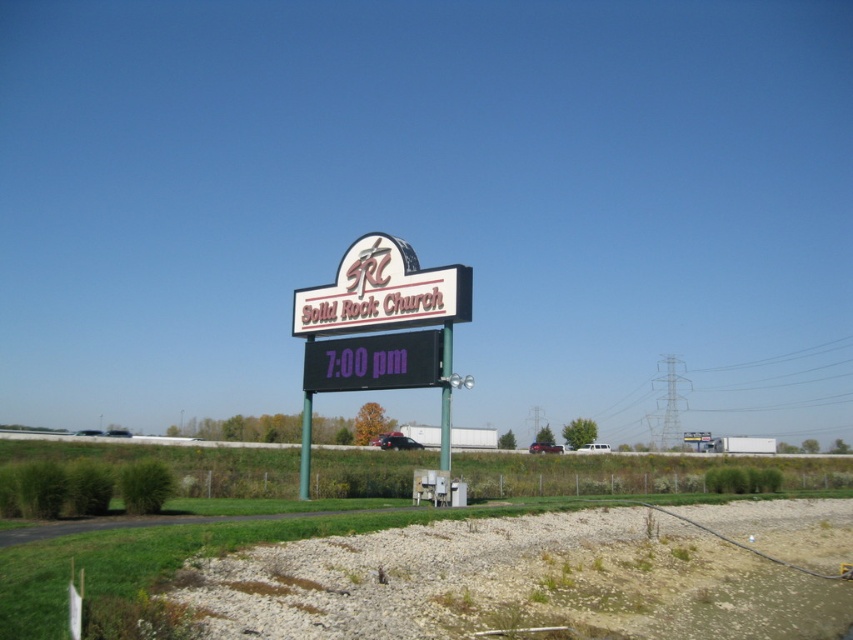
You are a delivery person trying to park your van near the Solid Rock Church sign. The van is 2 meters wide. The sign has a metallic part and a digital clock part. You need to know if the combined width of the metallic sign at center and the black digital clock at center is less than 2 meters to fit your van. Can you determine this?

The metallic sign at center might be wider than black digital clock at center, so the combined width could be more than 2 meters. Therefore, the van might not fit.

You are a delivery person trying to park your van near the Solid Rock Church sign. The van is 2.5 meters wide. The metallic sign at center and the white plastic sign at center are positioned along the path. Can you fit your van between them without hitting either sign?

The metallic sign at center is narrower than the white plastic sign at center. However, the exact distance between them isn not specified. Without knowing the spacing between the signs, it is impossible to determine if the van will fit. Please check the actual distance between the metallic sign at center and the white plastic sign at center before deciding.